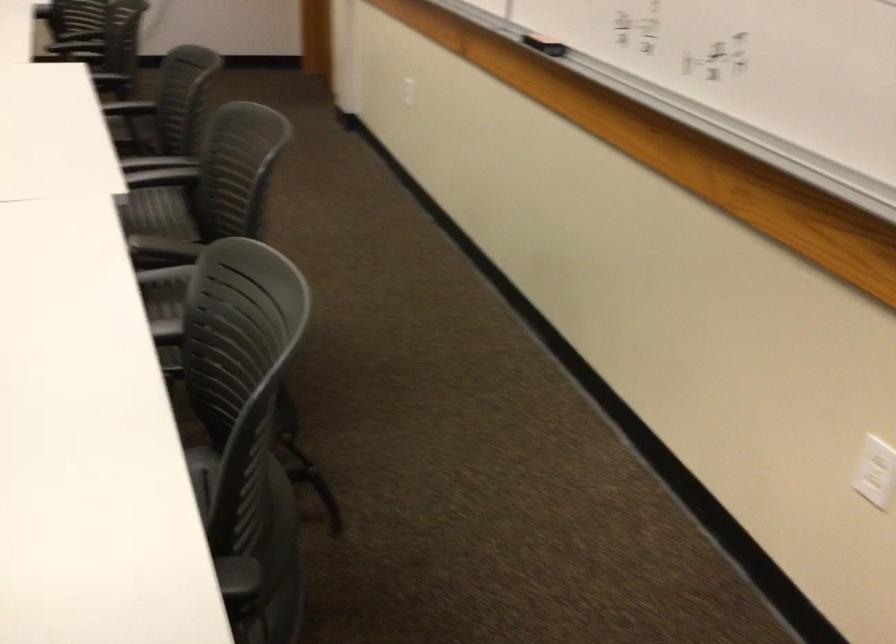
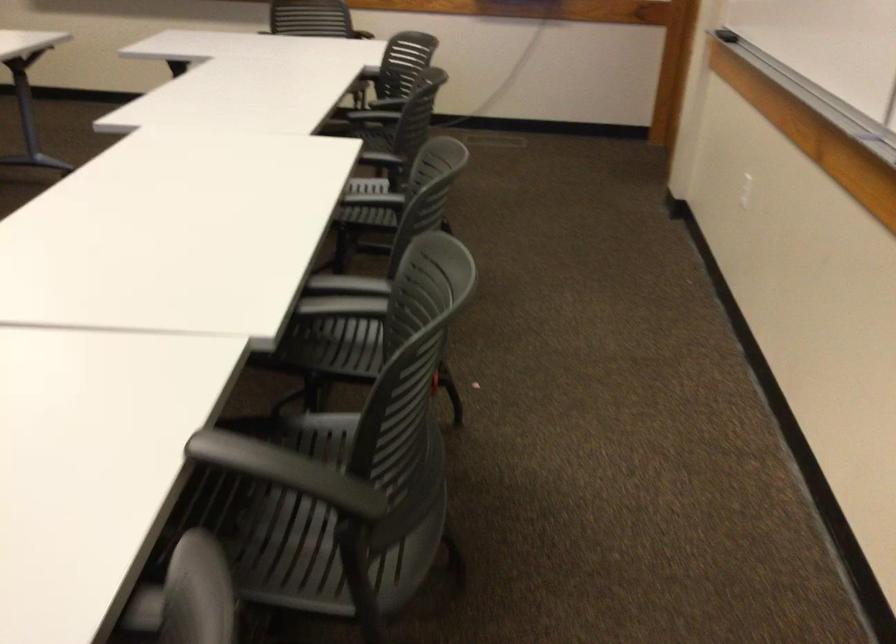
Where in the second image is the point corresponding to [218,257] from the first image?

(286, 471)